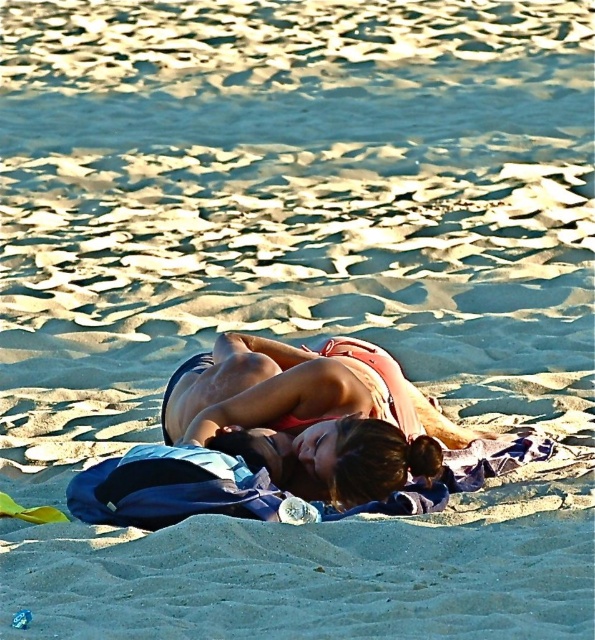
Question: Does pink fabric bikini at center appear on the left side of matte pink bikini at center?

Choices:
 (A) yes
 (B) no

Answer: (B)

Question: Which of the following is the closest to the observer?

Choices:
 (A) (393, 433)
 (B) (327, 426)

Answer: (A)

Question: Which of the following is the closest to the observer?

Choices:
 (A) matte pink bikini at center
 (B) pink fabric bikini at center

Answer: (A)

Question: Which point is closer to the camera taking this photo?

Choices:
 (A) [383, 442]
 (B) [321, 481]

Answer: (A)

Question: Can you confirm if pink fabric bikini at center is positioned to the right of matte pink bikini at center?

Choices:
 (A) no
 (B) yes

Answer: (B)

Question: Does pink fabric bikini at center have a larger size compared to matte pink bikini at center?

Choices:
 (A) no
 (B) yes

Answer: (B)